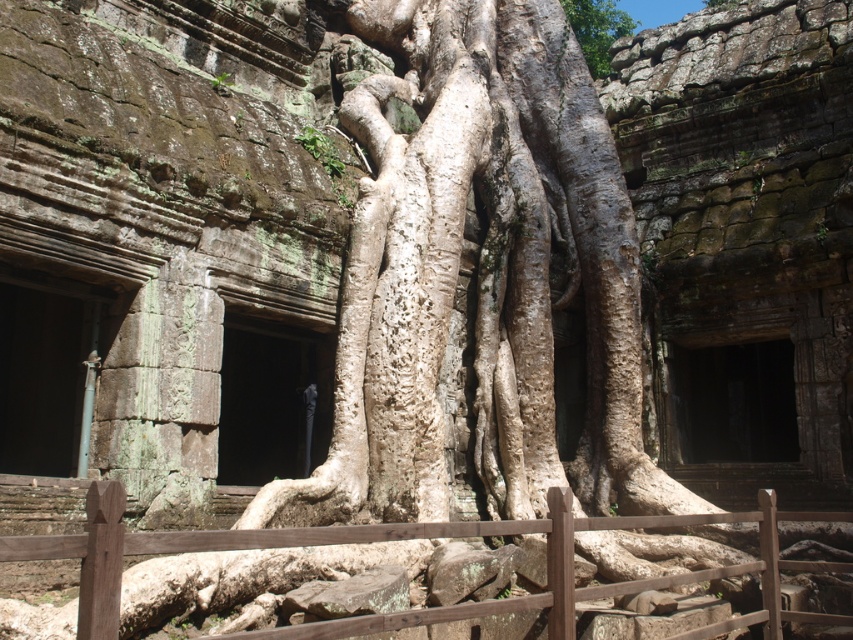
You are standing at the center of the image and want to locate the brown wooden fence at center. Which coordinate point would you look towards?

The brown wooden fence at center is located at coordinate point (384,540).

You are standing in front of the ancient temple ruins and notice the brown wooden fence at center and the white bark tree at upper center. Which object is positioned higher up in the scene?

The white bark tree at upper center is positioned higher up in the scene than the brown wooden fence at center.

You are a tourist standing in front of the ancient temple ruins. You see the brown wooden fence at center and the white bark tree at upper center. Which object is closer to you?

The brown wooden fence at center is closer to the viewer than the white bark tree at upper center.